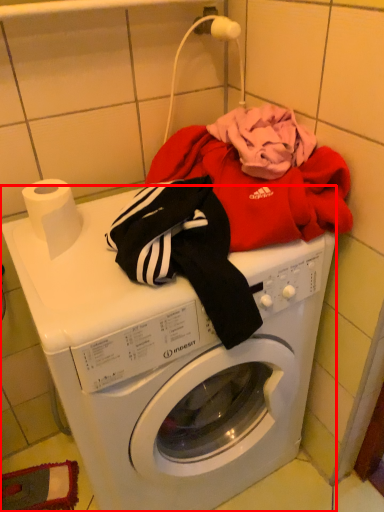
Question: Observing the image, what is the correct spatial positioning of washing machine (annotated by the red box) in reference to toilet paper?

Choices:
 (A) left
 (B) right

Answer: (B)